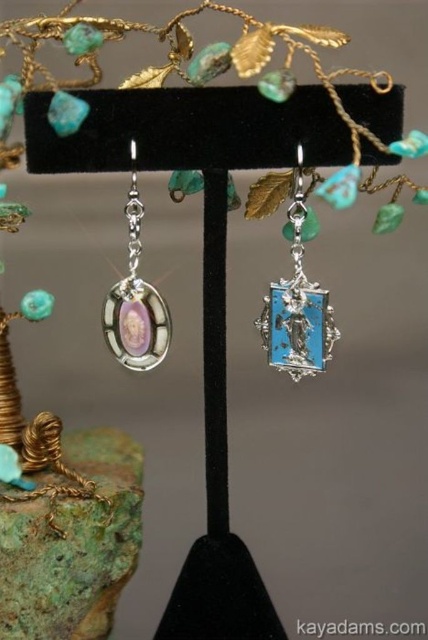
Consider the image. You are an appraiser examining the earrings. You notice a point marked at coordinates (73, 545). Which part of the earrings does this point correspond to?

The point at coordinates (73, 545) corresponds to the green patina stone at lower left.

You are an appraiser examining the earrings. You need to determine the spatial arrangement between the turquoise enamel angel at center and the matte silver oval at left. Which object is positioned to the right of the other?

The turquoise enamel angel at center is positioned to the right of the matte silver oval at left.

You are an appraiser examining the earrings. You notice the green patina stone at lower left and the turquoise enamel angel at center. Which of these two objects is shorter in height?

The green patina stone at lower left has a lesser height compared to the turquoise enamel angel at center, so the green patina stone at lower left is shorter in height.